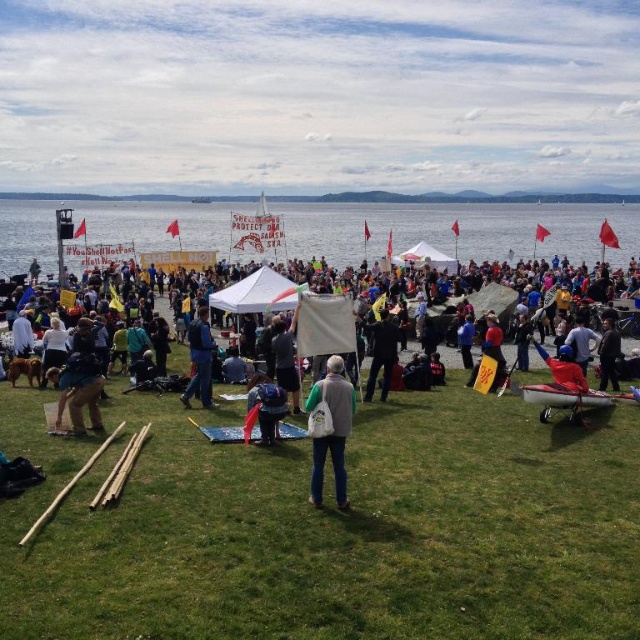
You are a photographer standing at the edge of the grassy area. You want to capture a photo of the dark blue backpack at center without including the green grass at center in the frame. Is the distance between them sufficient to allow you to position yourself so that the backpack is visible but the grass is out of the shot?

The distance between the green grass at center and dark blue backpack at center is 6.63 meters. Since you are already at the edge of the grassy area, you can position yourself far enough from the backpack to exclude the grass from the frame while still capturing the backpack clearly.

You are a photographer at the protest and need to capture a shot that includes both the denim jacket at lower left and the dark gray fabric at center. Which object should you focus on first to ensure both are in clear view?

The denim jacket at lower left is closer to the viewer than the dark gray fabric at center. To ensure both are in clear view, focus on the denim jacket at lower left first.

You are standing at the point labeled as point [268,420] and want to walk to the point labeled as point [129,586]. Which direction should you move relative to your current position?

You should move forward because point [129,586] is in front of point [268,420].